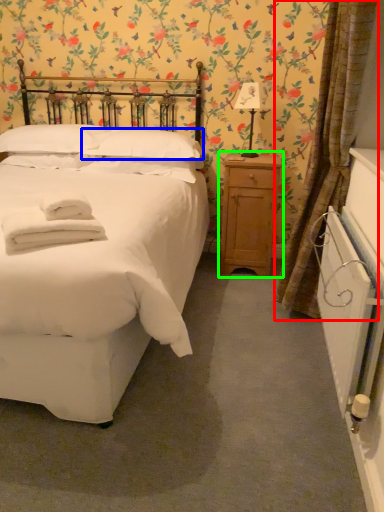
Question: Which is farther away from curtain (highlighted by a red box)? pillow (highlighted by a blue box) or nightstand (highlighted by a green box)?

Choices:
 (A) pillow
 (B) nightstand

Answer: (A)